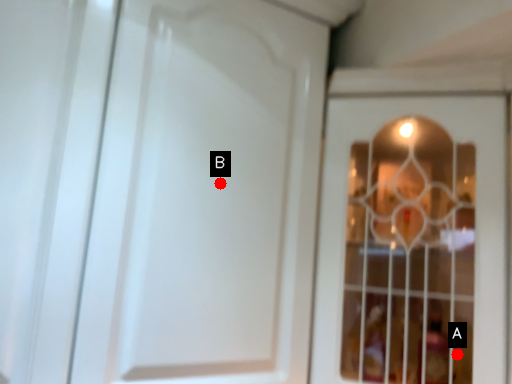
Question: Two points are circled on the image, labeled by A and B beside each circle. Which point is closer to the camera taking this photo?

Choices:
 (A) A is closer
 (B) B is closer

Answer: (B)